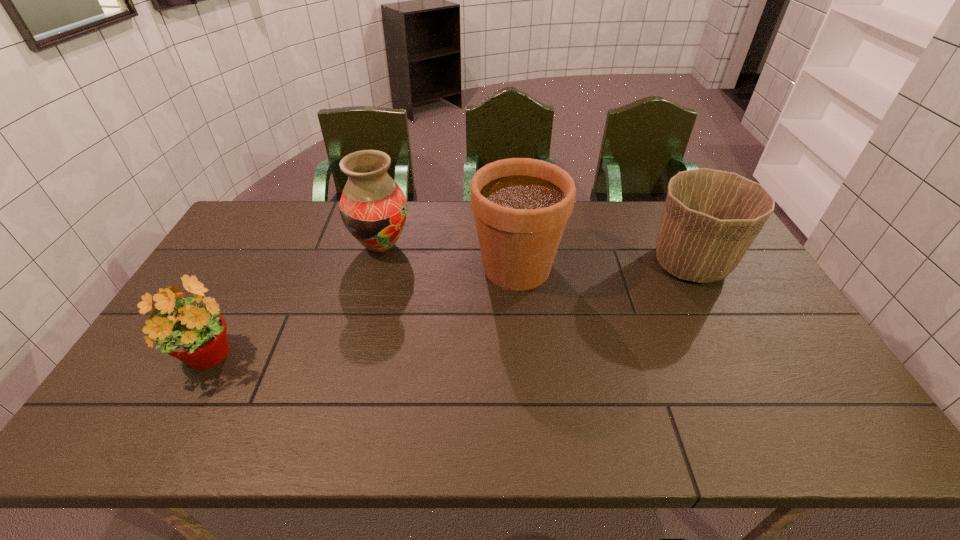
I want to click on free area in between the second flowerpot from right to left and the nearest flowerpot, so click(363, 313).

At what (x,y) coordinates should I click in order to perform the action: click on free space between the second object from left to right and the second object from right to left. Please return your answer as a coordinate pair (x, y). Looking at the image, I should click on (449, 257).

This screenshot has height=540, width=960. What are the coordinates of `free point between the second flowerpot from left to right and the vase` in the screenshot? It's located at (449, 257).

At what (x,y) coordinates should I click in order to perform the action: click on free space that is in between the second flowerpot from left to right and the leftmost flowerpot. Please return your answer as a coordinate pair (x, y). Looking at the image, I should click on (363, 313).

Where is `object that stands as the closest to the rightmost flowerpot`? This screenshot has width=960, height=540. object that stands as the closest to the rightmost flowerpot is located at coordinates (521, 206).

Locate which object is the third closest to the leftmost flowerpot. Please provide its 2D coordinates. Your answer should be formatted as a tuple, i.e. [(x, y)], where the tuple contains the x and y coordinates of a point satisfying the conditions above.

[(710, 218)]

Locate an element on the screen. This screenshot has width=960, height=540. the closest flowerpot to the leftmost flowerpot is located at coordinates (521, 206).

What are the coordinates of `flowerpot identified as the second closest to the third object from right to left` in the screenshot? It's located at click(x=195, y=334).